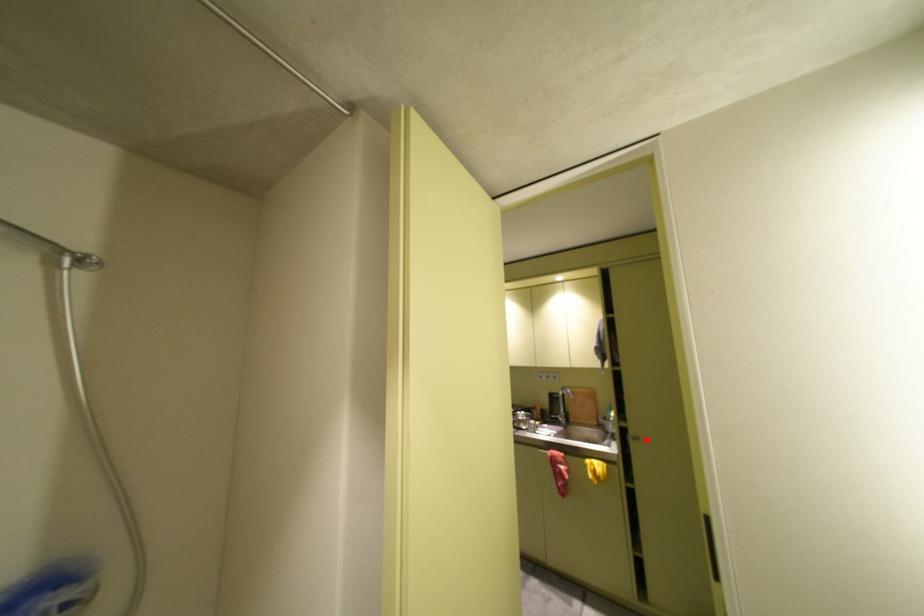
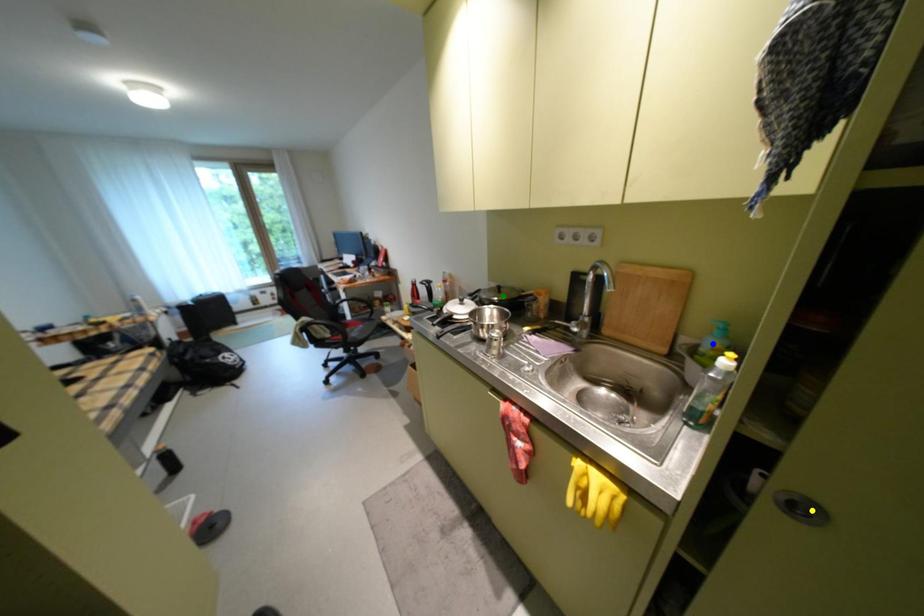
Question: I am providing you with two images of the same scene from different viewpoints. A red point is marked on the first image. You are given multiple points on the second image. Which mark in image 2 goes with the point in image 1?

Choices:
 (A) green point
 (B) blue point
 (C) yellow point

Answer: (C)